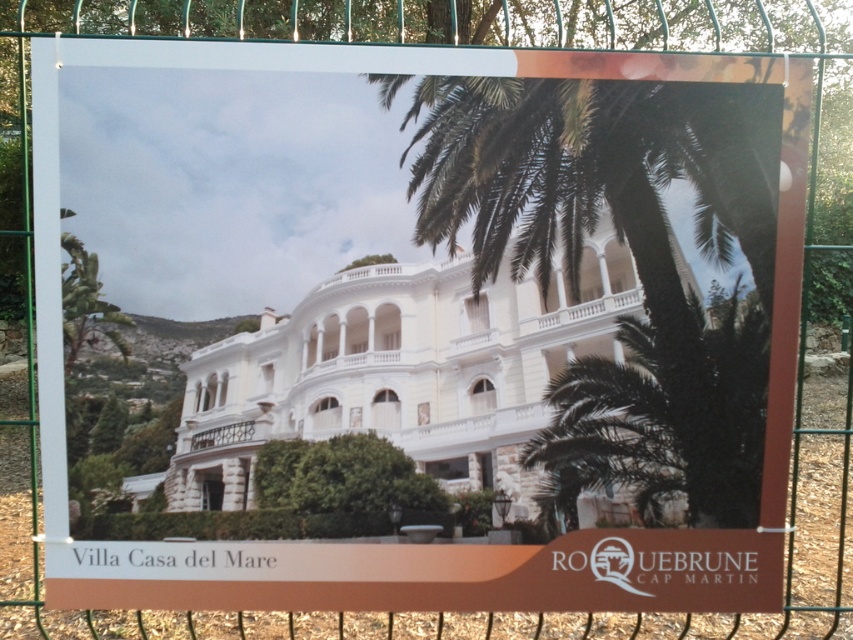
Between green leafy palm tree at upper right and green leafy palm tree at center, which one appears on the right side from the viewer's perspective?

green leafy palm tree at center is more to the right.

Which of these two, green leafy palm tree at upper right or green leafy palm tree at center, stands shorter?

green leafy palm tree at center is shorter.

Is point (595, 90) more distant than point (697, 480)?

No, it is not.

This screenshot has height=640, width=853. Find the location of `green leafy palm tree at upper right`. green leafy palm tree at upper right is located at coordinates (631, 257).